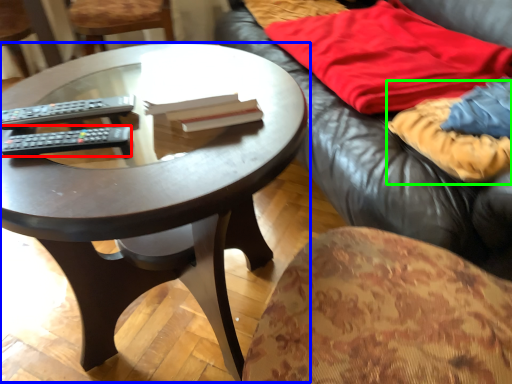
Question: Considering the real-world distances, which object is farthest from remote control (highlighted by a red box)? coffee table (highlighted by a blue box) or blanket (highlighted by a green box)?

Choices:
 (A) coffee table
 (B) blanket

Answer: (B)